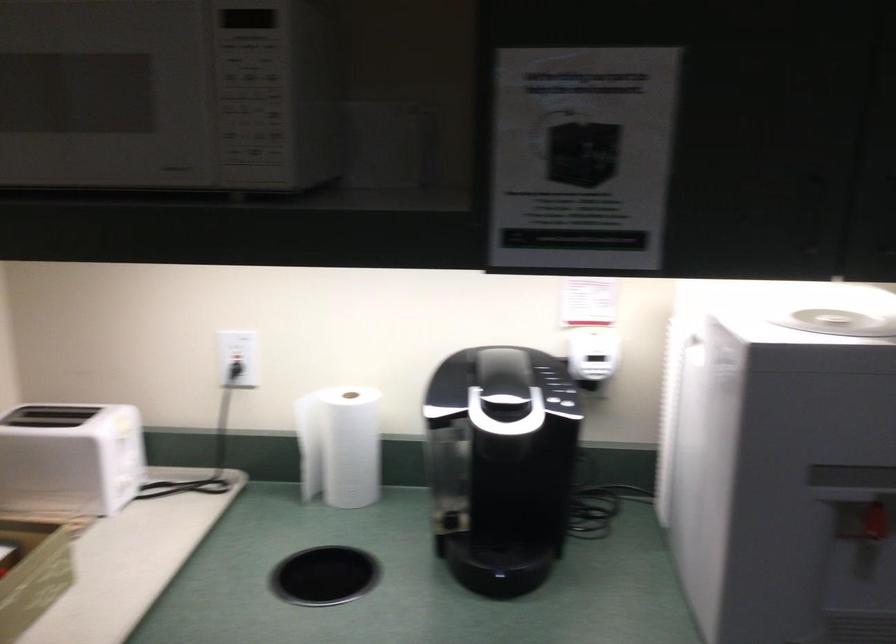
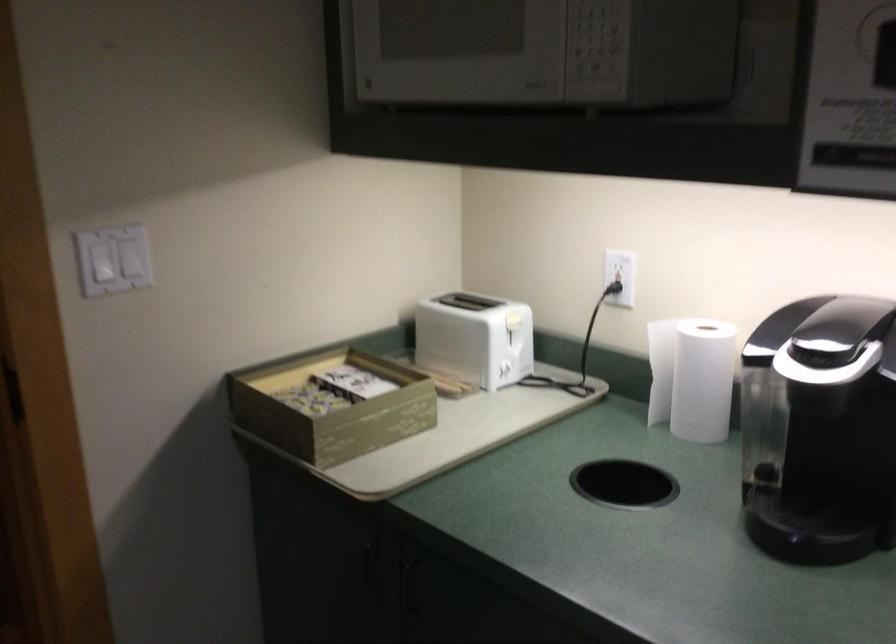
Locate, in the second image, the point that corresponds to pixel 123 426 in the first image.

(511, 317)